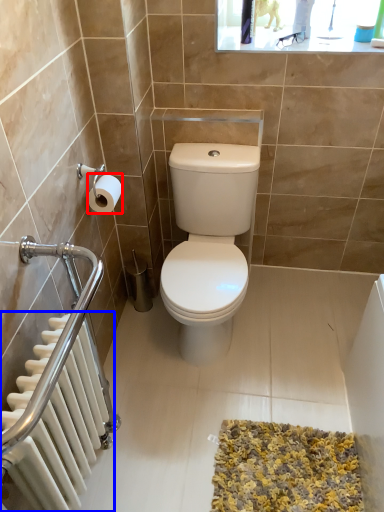
Question: Which object appears closest to the camera in this image, toilet paper (highlighted by a red box) or radiator (highlighted by a blue box)?

Choices:
 (A) toilet paper
 (B) radiator

Answer: (B)